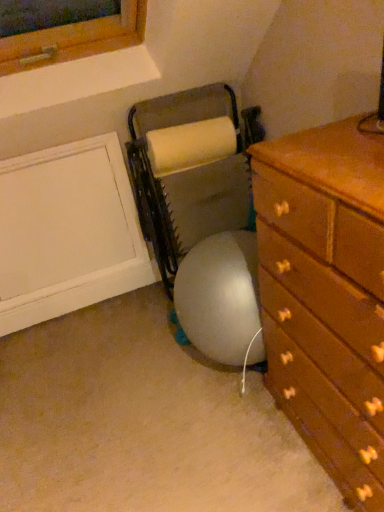
Where is `gray fabric bean bag chair at center`? gray fabric bean bag chair at center is located at coordinates (181, 155).

Describe the element at coordinates (181, 155) in the screenshot. The image size is (384, 512). I see `gray fabric bean bag chair at center` at that location.

Describe the element at coordinates (326, 296) in the screenshot. I see `wooden chest of drawers at lower right` at that location.

This screenshot has height=512, width=384. Identify the location of wooden chest of drawers at lower right. (326, 296).

Where is `gray fabric bean bag chair at center`? The width and height of the screenshot is (384, 512). gray fabric bean bag chair at center is located at coordinates (181, 155).

Does wooden chest of drawers at lower right appear on the left side of gray fabric bean bag chair at center?

No, wooden chest of drawers at lower right is not to the left of gray fabric bean bag chair at center.

Which object is closer to the camera taking this photo, wooden chest of drawers at lower right or gray fabric bean bag chair at center?

wooden chest of drawers at lower right.

Considering the points (297, 423) and (165, 197), which point is in front, point (297, 423) or point (165, 197)?

The point (297, 423) is in front.

From the image's perspective, which one is positioned lower, wooden chest of drawers at lower right or gray fabric bean bag chair at center?

wooden chest of drawers at lower right is shown below in the image.

From a real-world perspective, which is physically above, wooden chest of drawers at lower right or gray fabric bean bag chair at center?

From a 3D spatial view, gray fabric bean bag chair at center is above.

Does wooden chest of drawers at lower right have a greater width compared to gray fabric bean bag chair at center?

Yes.

Considering the sizes of objects wooden chest of drawers at lower right and gray fabric bean bag chair at center in the image provided, who is shorter, wooden chest of drawers at lower right or gray fabric bean bag chair at center?

gray fabric bean bag chair at center is shorter.

Considering the sizes of objects wooden chest of drawers at lower right and gray fabric bean bag chair at center in the image provided, who is bigger, wooden chest of drawers at lower right or gray fabric bean bag chair at center?

wooden chest of drawers at lower right.

Can we say wooden chest of drawers at lower right lies outside gray fabric bean bag chair at center?

Yes, wooden chest of drawers at lower right is outside of gray fabric bean bag chair at center.

Is there a large distance between wooden chest of drawers at lower right and gray fabric bean bag chair at center?

No, there isn't a large distance between wooden chest of drawers at lower right and gray fabric bean bag chair at center.

Is wooden chest of drawers at lower right aimed at gray fabric bean bag chair at center?

No, wooden chest of drawers at lower right is not turned towards gray fabric bean bag chair at center.

How different are the orientations of wooden chest of drawers at lower right and gray fabric bean bag chair at center in degrees?

88 degrees.

Locate an element on the screen. chest of drawers to the right of gray fabric bean bag chair at center is located at coordinates (326, 296).

Considering the relative positions of gray fabric bean bag chair at center and wooden chest of drawers at lower right in the image provided, is gray fabric bean bag chair at center to the left or to the right of wooden chest of drawers at lower right?

From the image, it's evident that gray fabric bean bag chair at center is to the left of wooden chest of drawers at lower right.

Is the position of gray fabric bean bag chair at center less distant than that of wooden chest of drawers at lower right?

No, gray fabric bean bag chair at center is behind wooden chest of drawers at lower right.

Between point (233, 103) and point (307, 337), which one is positioned in front?

Positioned in front is point (307, 337).

From the image's perspective, between gray fabric bean bag chair at center and wooden chest of drawers at lower right, who is located below?

From the image's view, wooden chest of drawers at lower right is below.

From a real-world perspective, is gray fabric bean bag chair at center on top of wooden chest of drawers at lower right?

Indeed, from a real-world perspective, gray fabric bean bag chair at center stands above wooden chest of drawers at lower right.

Does gray fabric bean bag chair at center have a greater width compared to wooden chest of drawers at lower right?

No, gray fabric bean bag chair at center is not wider than wooden chest of drawers at lower right.

Does gray fabric bean bag chair at center have a lesser height compared to wooden chest of drawers at lower right?

Indeed, gray fabric bean bag chair at center has a lesser height compared to wooden chest of drawers at lower right.

Does gray fabric bean bag chair at center have a larger size compared to wooden chest of drawers at lower right?

Incorrect, gray fabric bean bag chair at center is not larger than wooden chest of drawers at lower right.

Do you think gray fabric bean bag chair at center is within wooden chest of drawers at lower right, or outside of it?

gray fabric bean bag chair at center is not enclosed by wooden chest of drawers at lower right.

Based on the photo, is gray fabric bean bag chair at center touching wooden chest of drawers at lower right?

No, gray fabric bean bag chair at center is not with wooden chest of drawers at lower right.

In the scene shown: Is gray fabric bean bag chair at center aimed at wooden chest of drawers at lower right?

Yes, gray fabric bean bag chair at center is turned towards wooden chest of drawers at lower right.

How different are the orientations of gray fabric bean bag chair at center and wooden chest of drawers at lower right in degrees?

They differ by 88 degrees in their facing directions.

This screenshot has width=384, height=512. I want to click on chest of drawers below the gray fabric bean bag chair at center (from the image's perspective), so click(326, 296).

This screenshot has height=512, width=384. Find the location of `bean bag chair that is above the wooden chest of drawers at lower right (from a real-world perspective)`. bean bag chair that is above the wooden chest of drawers at lower right (from a real-world perspective) is located at coordinates (181, 155).

You are a GUI agent. You are given a task and a screenshot of the screen. Output one action in this format:
    pyautogui.click(x=<x>, y=<y>)
    Task: Click on the chest of drawers in front of the gray fabric bean bag chair at center
    
    Given the screenshot: What is the action you would take?
    pyautogui.click(x=326, y=296)